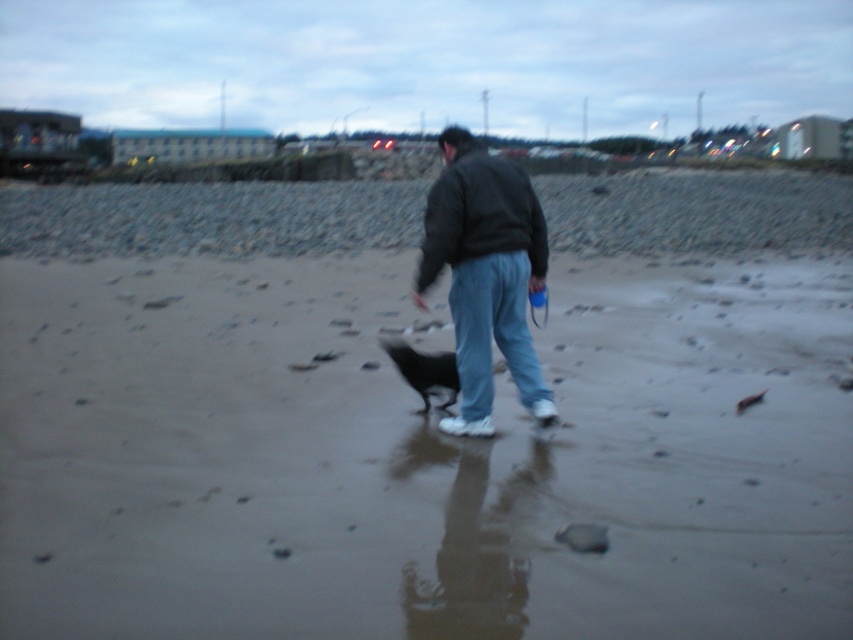
In the scene shown: You are standing at the beach and see the dark gray jacket at center. If you want to reach the jacket quickly, how many steps would you estimate to take, assuming each step covers about 3 feet?

The dark gray jacket at center is 14.77 feet away from viewer. Dividing the distance by the step length of 3 feet gives approximately 4.92 steps. Since you can only take whole steps, you would need about 5 steps to reach the jacket.

You are standing on the smooth sand beach at center and looking towards the dark gray fleece sweatshirt at center. Which object is closer to you?

The smooth sand beach at center is closer to you because it is in front of the dark gray fleece sweatshirt at center.

You are a photographer trying to capture a clear photo of the dark gray jacket at center and the black fur dog at center. Since the lighting is dim, you need to adjust your camera settings. Which object should you focus on first to ensure it appears sharp in the photo?

The dark gray jacket at center has a larger size compared to black fur dog at center, so you should focus on the dark gray jacket at center first because larger objects require more precise focus to maintain sharpness in low light conditions.